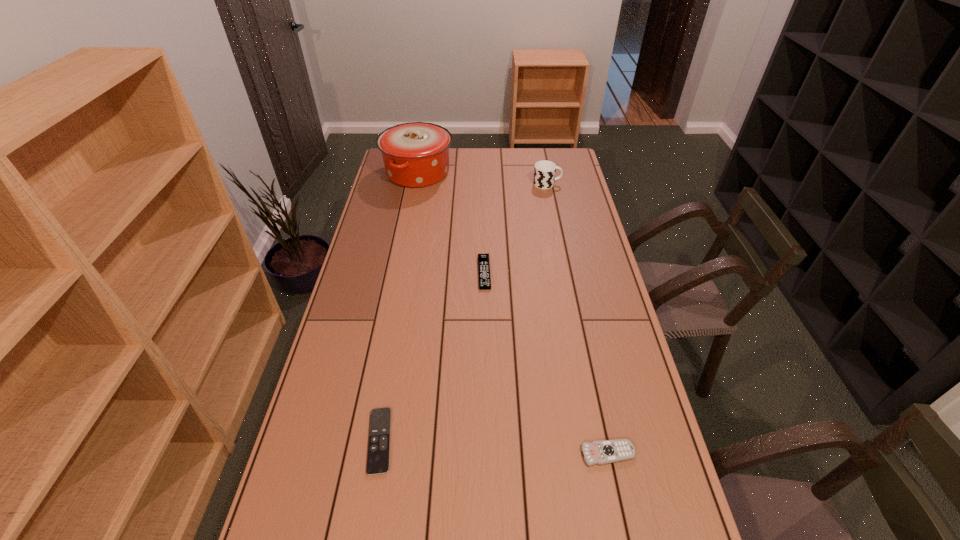
Identify which object is the third closest to the rightmost remote control. Please provide its 2D coordinates. Your answer should be formatted as a tuple, i.e. [(x, y)], where the tuple contains the x and y coordinates of a point satisfying the conditions above.

[(544, 173)]

This screenshot has width=960, height=540. I want to click on object identified as the third closest to the leftmost remote control, so click(x=416, y=154).

Find the location of a particular element. The image size is (960, 540). remote control that is the second closest one to the rightmost remote control is located at coordinates (483, 259).

At what (x,y) coordinates should I click in order to perform the action: click on remote control that is the second closest to the cup. Please return your answer as a coordinate pair (x, y). The height and width of the screenshot is (540, 960). Looking at the image, I should click on (607, 451).

Find the location of a particular element. free location that satisfies the following two spatial constraints: 1. on the front side of the rightmost remote control; 2. on the left side of the tallest object is located at coordinates (364, 454).

What are the coordinates of `blank space that satisfies the following two spatial constraints: 1. on the front side of the shortest object; 2. on the right side of the rightmost remote control` in the screenshot? It's located at (377, 454).

Where is `vacant area in the image that satisfies the following two spatial constraints: 1. on the front side of the shortest object; 2. on the right side of the rightmost remote control`? The height and width of the screenshot is (540, 960). vacant area in the image that satisfies the following two spatial constraints: 1. on the front side of the shortest object; 2. on the right side of the rightmost remote control is located at coordinates (377, 454).

Find the location of a particular element. This screenshot has width=960, height=540. vacant region that satisfies the following two spatial constraints: 1. on the side of the cup with the handle; 2. on the front side of the shortest object is located at coordinates (598, 441).